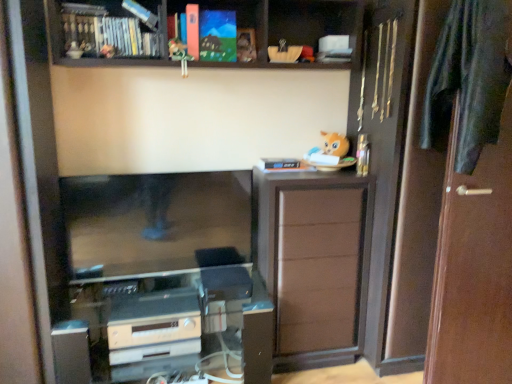
Question: From a real-world perspective, is satin silver appliance at lower center positioned above or below matte acrylic painting at upper center, the 2th book when ordered from left to right?

Choices:
 (A) above
 (B) below

Answer: (B)

Question: Considering the positions of satin silver appliance at lower center and matte acrylic painting at upper center, the 2th book when ordered from left to right, in the image, is satin silver appliance at lower center taller or shorter than matte acrylic painting at upper center, the 2th book when ordered from left to right,?

Choices:
 (A) tall
 (B) short

Answer: (B)

Question: Based on their relative distances, which object is farther from the fluffy plush toy at upper right, placed as the second toy when sorted from left to right?

Choices:
 (A) matte black tv at center
 (B) matte acrylic painting at upper center, which ranks as the 1th book in right-to-left order
 (C) brown wood door at right
 (D) satin silver appliance at lower center
 (E) matte black book at upper left, the 2th book from the right

Answer: (D)

Question: Which object is positioned farthest from the wooden bookshelf at upper center?

Choices:
 (A) satin silver appliance at lower center
 (B) matte black tv at center
 (C) dark green fabric at right
 (D) brown matte cabinet at right
 (E) fluffy plush toy at upper right, the second toy in the front-to-back sequence

Answer: (A)